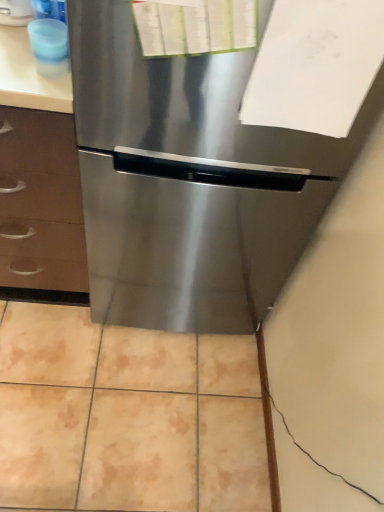
This screenshot has height=512, width=384. In order to click on empty space that is ontop of beige ceramic tile at center (from a real-world perspective) in this screenshot , I will do `click(121, 376)`.